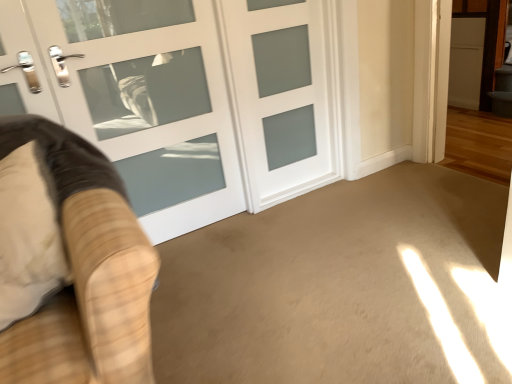
Question: Should I look upward or downward to see white frosted glass door at center, positioned as the 2th door in right-to-left order?

Choices:
 (A) up
 (B) down

Answer: (A)

Question: Considering the relative positions of beige carpet at center and white frosted glass door at center, which is the 1th door in right-to-left order, in the image provided, is beige carpet at center in front of white frosted glass door at center, which is the 1th door in right-to-left order,?

Choices:
 (A) no
 (B) yes

Answer: (B)

Question: Considering the relative sizes of beige carpet at center and white frosted glass door at center, the second door from the left, in the image provided, is beige carpet at center taller than white frosted glass door at center, the second door from the left,?

Choices:
 (A) no
 (B) yes

Answer: (A)

Question: Would you say white frosted glass door at center, which is the 1th door in right-to-left order, is part of beige carpet at center's contents?

Choices:
 (A) no
 (B) yes

Answer: (A)

Question: Is beige carpet at center beside white frosted glass door at center, which is the 1th door in right-to-left order?

Choices:
 (A) no
 (B) yes

Answer: (A)

Question: Is beige carpet at center positioned beyond the bounds of white frosted glass door at center, the second door from the left?

Choices:
 (A) yes
 (B) no

Answer: (A)

Question: Could you tell me if beige carpet at center is facing white frosted glass door at center, which is the 1th door in right-to-left order?

Choices:
 (A) no
 (B) yes

Answer: (A)

Question: Is white frosted glass door at center, which is the 1th door in right-to-left order, turned away from white frosted glass door at center, positioned as the 1th door in left-to-right order?

Choices:
 (A) yes
 (B) no

Answer: (A)

Question: Does white frosted glass door at center, which is the 1th door in right-to-left order, have a lesser height compared to white frosted glass door at center, positioned as the 2th door in right-to-left order?

Choices:
 (A) no
 (B) yes

Answer: (B)

Question: Is white frosted glass door at center, which is the 1th door in right-to-left order, positioned far away from white frosted glass door at center, positioned as the 2th door in right-to-left order?

Choices:
 (A) yes
 (B) no

Answer: (B)

Question: Considering the relative sizes of white frosted glass door at center, the second door from the left, and white frosted glass door at center, positioned as the 1th door in left-to-right order, in the image provided, is white frosted glass door at center, the second door from the left, wider than white frosted glass door at center, positioned as the 1th door in left-to-right order,?

Choices:
 (A) yes
 (B) no

Answer: (B)

Question: Is white frosted glass door at center, the second door from the left, at the right side of white frosted glass door at center, positioned as the 1th door in left-to-right order?

Choices:
 (A) no
 (B) yes

Answer: (B)

Question: Is white frosted glass door at center, positioned as the 1th door in left-to-right order, located within white frosted glass door at center, which is the 1th door in right-to-left order?

Choices:
 (A) no
 (B) yes

Answer: (A)

Question: From a real-world perspective, is velvet beige armchair at left over white frosted glass door at center, positioned as the 1th door in left-to-right order?

Choices:
 (A) yes
 (B) no

Answer: (B)